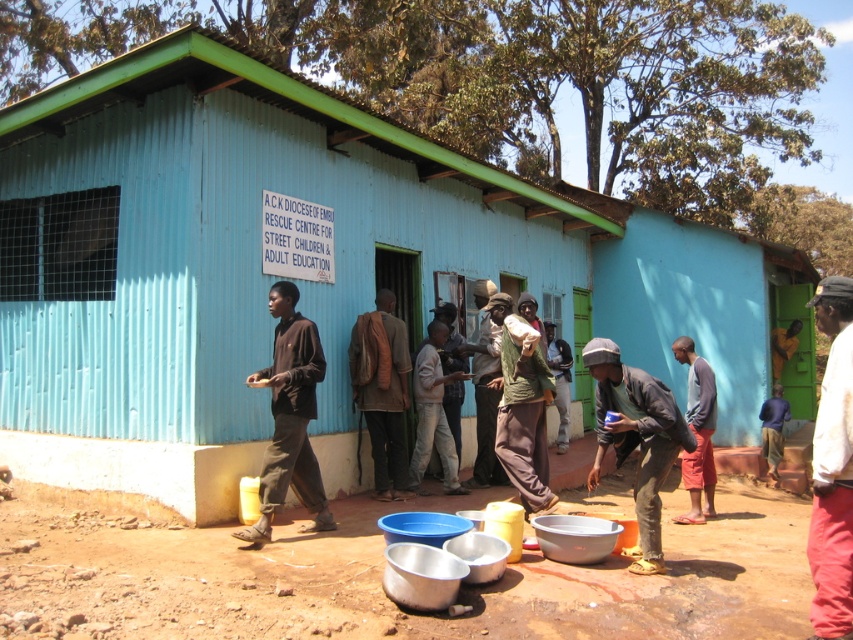
Consider the image. You are standing at the Rescue Centre for Street Children and Adult Education and want to walk from point A to point B. Point A is at coordinates point (279, 320) and point B is at coordinates point (372, 380). Which direction should you face to walk towards point B from point A?

To walk from point A at coordinates point (279, 320) to point B at coordinates point (372, 380), you should face northeast because point B is located northeast of point A.

You are a photographer standing 2 meters away from the dark brown fabric shirt at center and want to take a photo of the brown leather backpack at center without the shirt blocking it. Can you move closer to the backpack to ensure it is fully visible?

The dark brown fabric shirt at center is 1.77 meters from the brown leather backpack at center. Since you are already 2 meters away from the shirt, moving closer to the backpack would reduce the distance between you and the backpack but the shirt might still block the view. To ensure the backpack is fully visible without obstruction, you need to position yourself such that the shirt is no longer in front of the backpack. This might require moving to the side rather than directly forward.